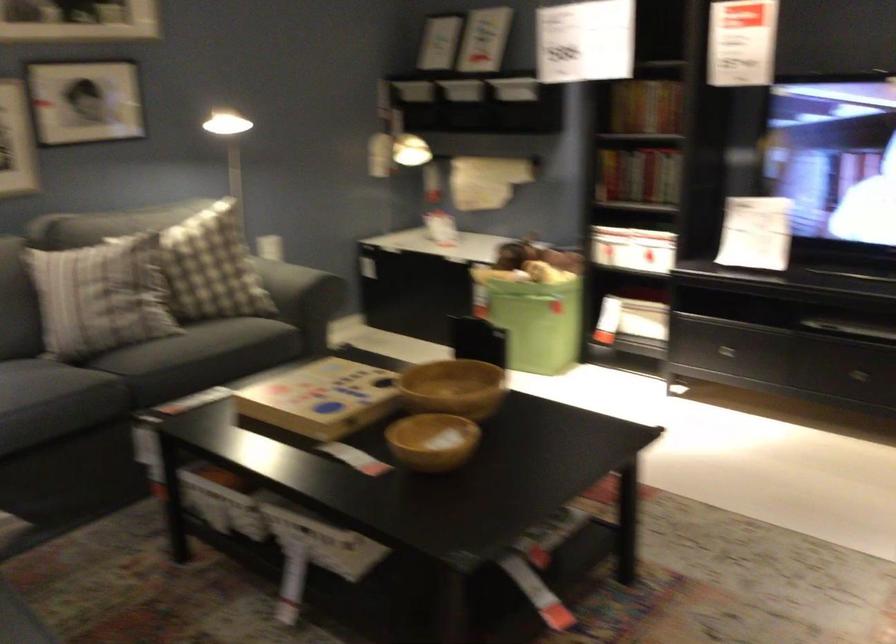
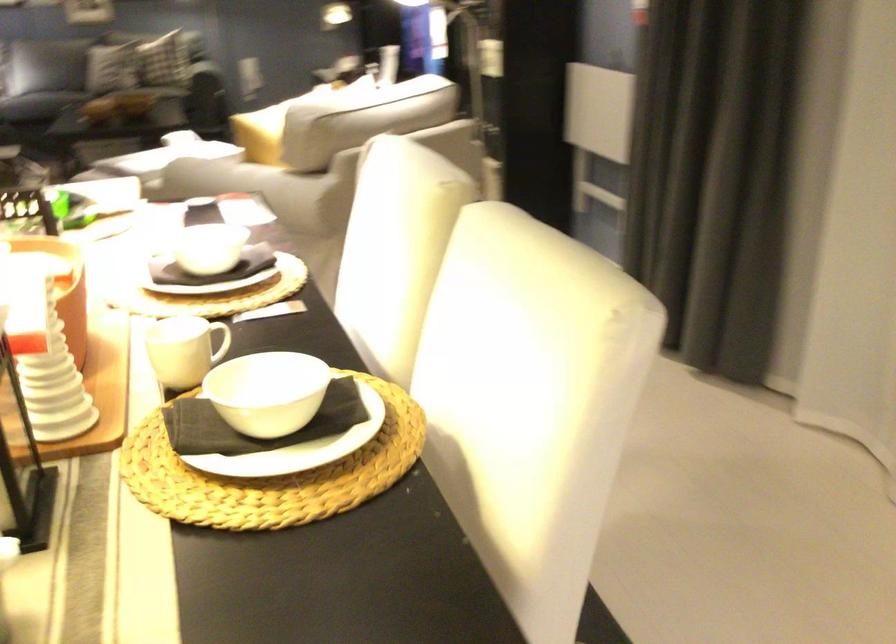
Question: I am providing you with two images of the same scene from different viewpoints. After the viewpoint changes to image2, which objects are now occluded?

Choices:
 (A) dark napkin
 (B) gray spray bottle
 (C) white storage bin
 (D) sofa armrest

Answer: (C)